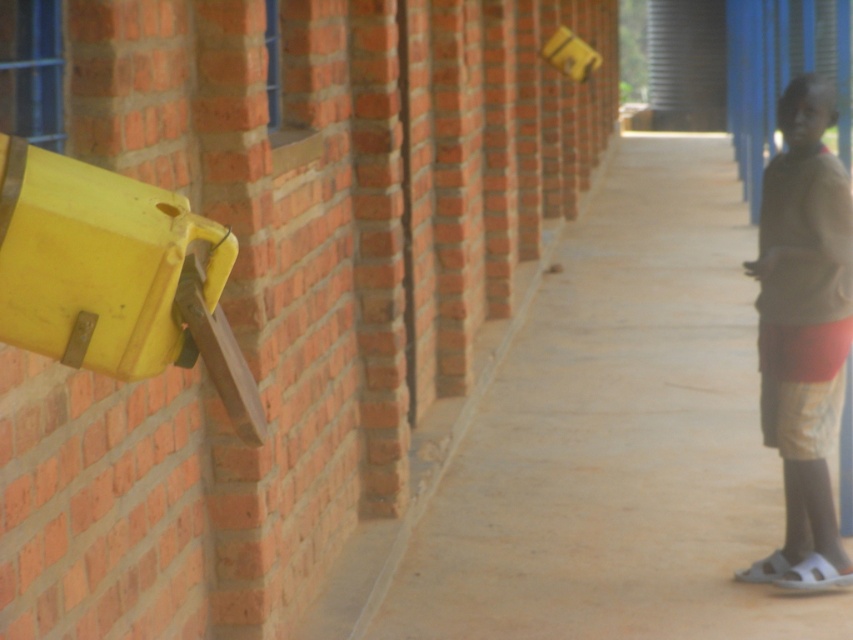
Does smooth concrete pavement at center appear on the right side of brown cotton shirt at right?

Yes, smooth concrete pavement at center is to the right of brown cotton shirt at right.

Does smooth concrete pavement at center come behind brown cotton shirt at right?

No.

Who is more distant from viewer, (675, 216) or (782, 138)?

Positioned behind is point (675, 216).

Image resolution: width=853 pixels, height=640 pixels. What are the coordinates of `smooth concrete pavement at center` in the screenshot? It's located at (613, 440).